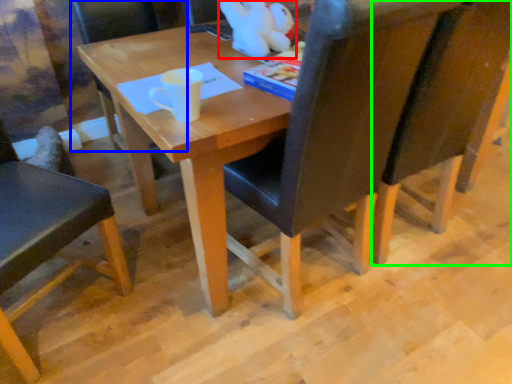
Question: Which object is positioned farthest from toy (highlighted by a red box)? Select from chair (highlighted by a blue box) and chair (highlighted by a green box).

Choices:
 (A) chair
 (B) chair

Answer: (A)